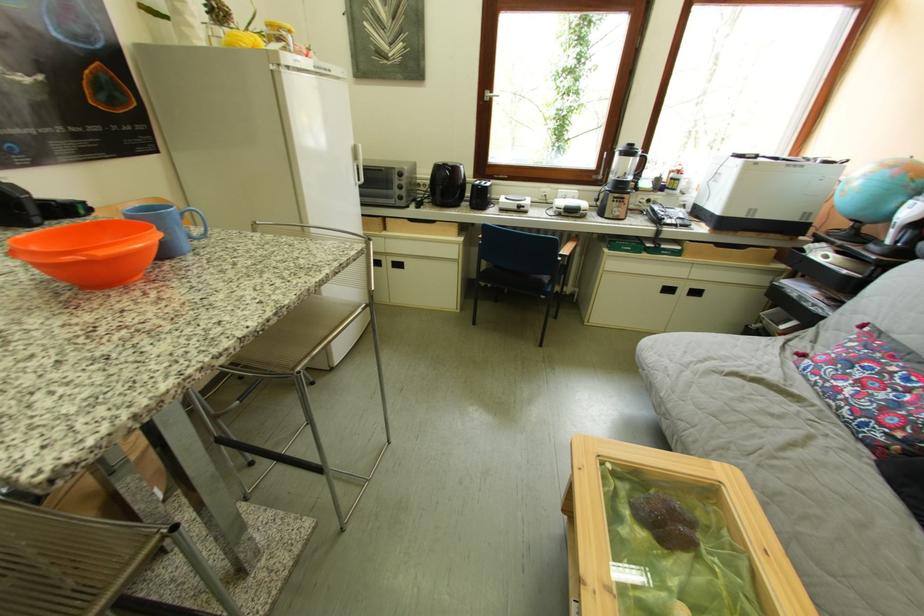
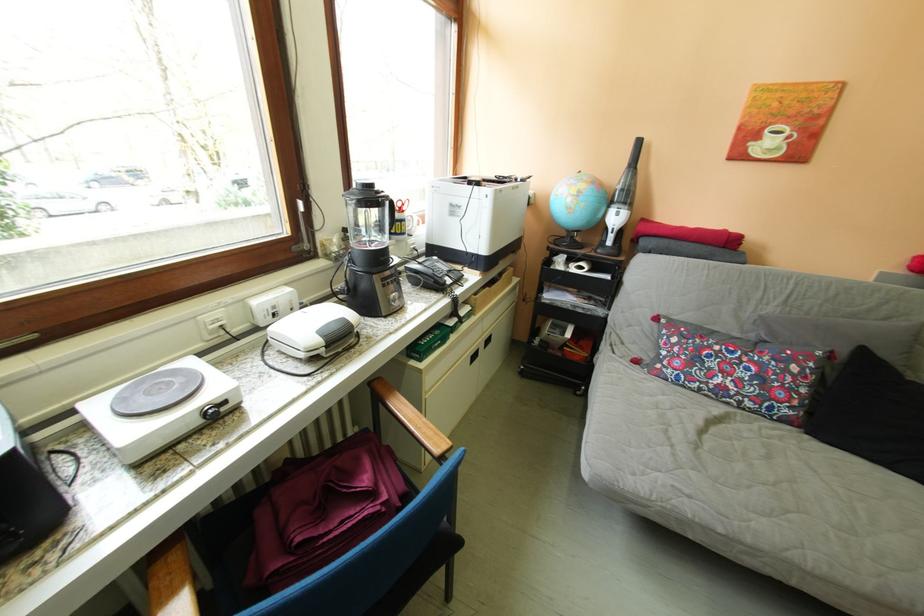
Locate, in the second image, the point that corresponds to point 536,209 in the first image.

(237, 406)